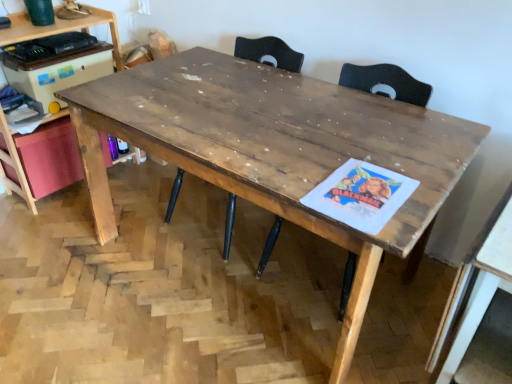
Locate an element on the screen. free space that is in between wooden table at center, placed as the second table when sorted from right to left, and wooden computer desk at left is located at coordinates (120, 211).